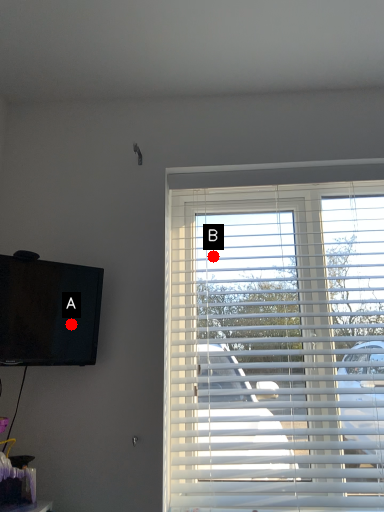
Question: Two points are circled on the image, labeled by A and B beside each circle. Which point is further to the camera?

Choices:
 (A) A is further
 (B) B is further

Answer: (B)